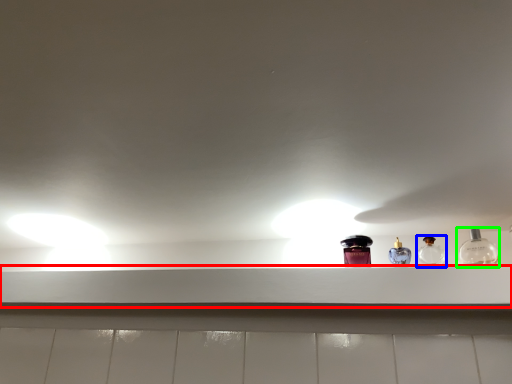
Question: Which is farther away from window sill (highlighted by a red box)? bottle (highlighted by a blue box) or bottle (highlighted by a green box)?

Choices:
 (A) bottle
 (B) bottle

Answer: (B)